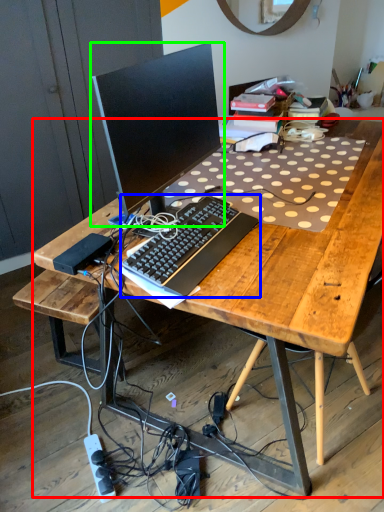
Question: Considering the real-world distances, which object is farthest from desk (highlighted by a red box)? computer keyboard (highlighted by a blue box) or computer monitor (highlighted by a green box)?

Choices:
 (A) computer keyboard
 (B) computer monitor

Answer: (B)